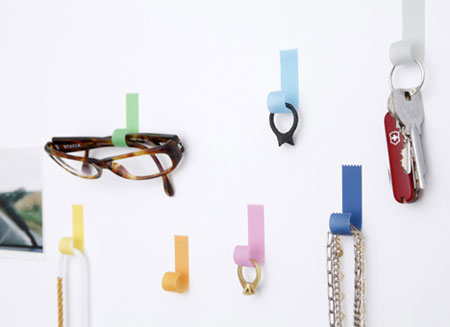
Where is `hooks not holding anything`? This screenshot has width=450, height=327. hooks not holding anything is located at coordinates (175, 272).